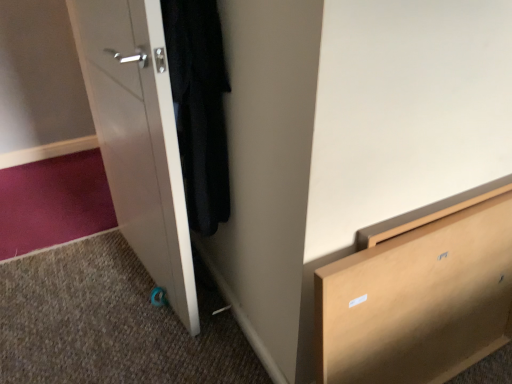
Locate an element on the screen. vacant space positioned to the left of white glossy door at left is located at coordinates 73,292.